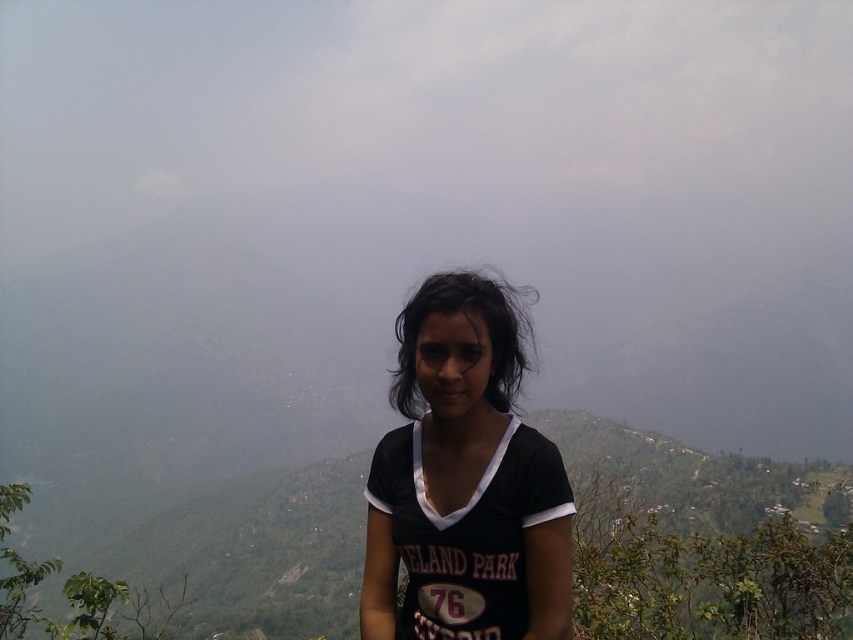
Question: Which point is closer to the camera?

Choices:
 (A) black matte hair at center
 (B) black matte shirt at center

Answer: (B)

Question: Can you confirm if black matte shirt at center is positioned above black matte hair at center?

Choices:
 (A) no
 (B) yes

Answer: (A)

Question: Among these points, which one is farthest from the camera?

Choices:
 (A) (532, 346)
 (B) (467, 298)

Answer: (A)

Question: Which point is farther to the camera?

Choices:
 (A) (473, 529)
 (B) (473, 284)

Answer: (B)

Question: In this image, where is black matte shirt at center located relative to black matte hair at center?

Choices:
 (A) above
 (B) below

Answer: (B)

Question: Can you confirm if black matte shirt at center is thinner than black matte hair at center?

Choices:
 (A) no
 (B) yes

Answer: (B)